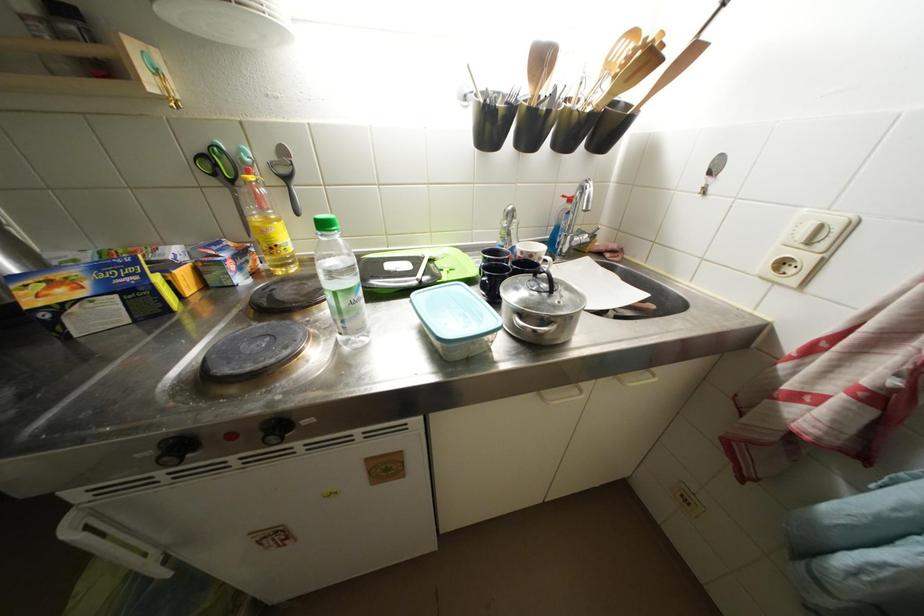
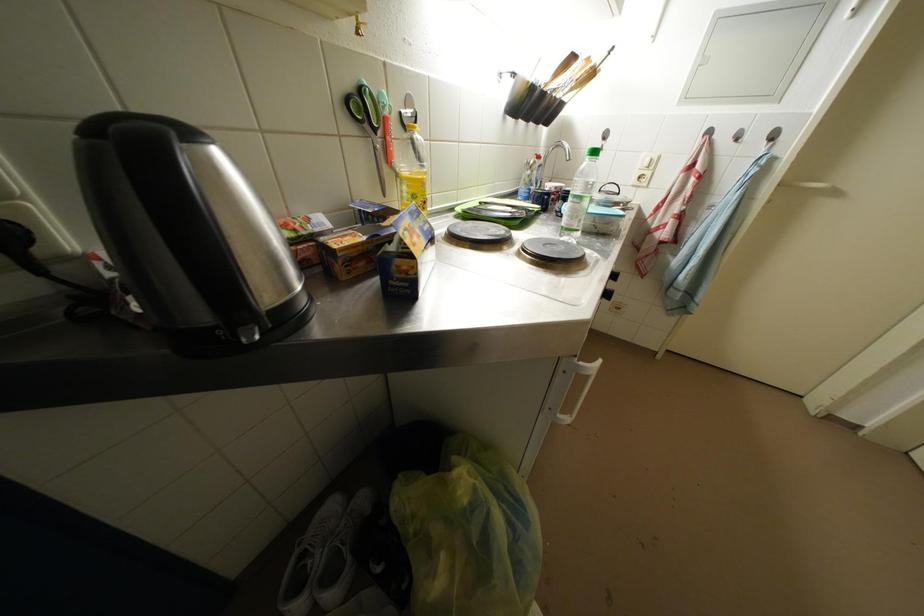
Question: The images are taken continuously from a first-person perspective. In which direction is your viewpoint rotating?

Choices:
 (A) Left
 (B) Right
 (C) Up
 (D) Down

Answer: (B)